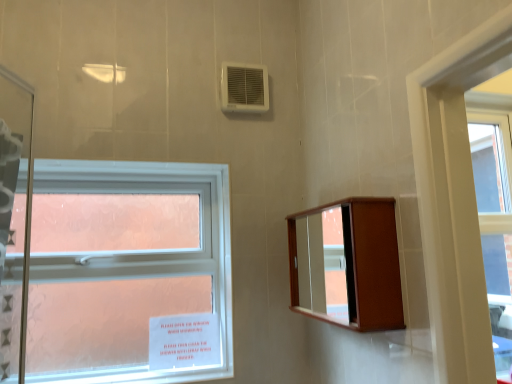
Locate an element on the screen. This screenshot has height=384, width=512. clear glass window at left is located at coordinates (145, 252).

The width and height of the screenshot is (512, 384). In order to click on white plastic air conditioning unit at upper center in this screenshot , I will do `click(244, 88)`.

Describe the element at coordinates (347, 264) in the screenshot. I see `wooden medicine cabinet at upper right` at that location.

This screenshot has width=512, height=384. In order to click on clear glass window at left in this screenshot , I will do `click(145, 252)`.

Based on the photo, is white plastic air conditioning unit at upper center surrounded by wooden medicine cabinet at upper right?

Definitely not — white plastic air conditioning unit at upper center is not inside wooden medicine cabinet at upper right.

Who is shorter, wooden medicine cabinet at upper right or white plastic air conditioning unit at upper center?

white plastic air conditioning unit at upper center is shorter.

From the image's perspective, which one is positioned lower, wooden medicine cabinet at upper right or white plastic air conditioning unit at upper center?

wooden medicine cabinet at upper right.

Is wooden medicine cabinet at upper right touching white plastic air conditioning unit at upper center?

No, wooden medicine cabinet at upper right is not touching white plastic air conditioning unit at upper center.

How different are the orientations of white plastic air conditioning unit at upper center and clear glass window at left in degrees?

0.163 degrees.

At what (x,y) coordinates should I click in order to perform the action: click on air conditioning located above the clear glass window at left (from a real-world perspective). Please return your answer as a coordinate pair (x, y). The image size is (512, 384). Looking at the image, I should click on (244, 88).

From the image's perspective, is white plastic air conditioning unit at upper center above or below clear glass window at left?

white plastic air conditioning unit at upper center is situated higher than clear glass window at left in the image.

How distant is white plastic air conditioning unit at upper center from clear glass window at left?

white plastic air conditioning unit at upper center is 22.80 inches away from clear glass window at left.

Can you confirm if clear glass window at left is smaller than white plastic air conditioning unit at upper center?

Incorrect, clear glass window at left is not smaller in size than white plastic air conditioning unit at upper center.

Between clear glass window at left and white plastic air conditioning unit at upper center, which one appears on the left side from the viewer's perspective?

clear glass window at left.

Does point (108, 372) come closer to viewer compared to point (246, 66)?

Yes, point (108, 372) is closer to viewer.

From a real-world perspective, between wooden medicine cabinet at upper right and clear glass window at left, who is vertically higher?

In real-world perspective, wooden medicine cabinet at upper right is above.

Relative to clear glass window at left, is wooden medicine cabinet at upper right in front or behind?

In the image, wooden medicine cabinet at upper right appears in front of clear glass window at left.

Does wooden medicine cabinet at upper right have a greater height compared to clear glass window at left?

No.

Considering the positions of point (380, 234) and point (94, 167), is point (380, 234) closer or farther from the camera than point (94, 167)?

Point (380, 234).

Is clear glass window at left smaller than wooden medicine cabinet at upper right?

No, clear glass window at left is not smaller than wooden medicine cabinet at upper right.

Who is taller, clear glass window at left or wooden medicine cabinet at upper right?

clear glass window at left.

Locate an element on the screen. This screenshot has height=384, width=512. window that appears below the wooden medicine cabinet at upper right (from the image's perspective) is located at coordinates (145, 252).

Is white plastic air conditioning unit at upper center taller or shorter than wooden medicine cabinet at upper right?

In the image, white plastic air conditioning unit at upper center appears to be shorter than wooden medicine cabinet at upper right.

Which is less distant, (254,101) or (366,259)?

The point (366,259) is more forward.

Is the depth of white plastic air conditioning unit at upper center less than that of wooden medicine cabinet at upper right?

No, white plastic air conditioning unit at upper center is further to the viewer.

Are white plastic air conditioning unit at upper center and wooden medicine cabinet at upper right located far from each other?

Actually, white plastic air conditioning unit at upper center and wooden medicine cabinet at upper right are a little close together.

Image resolution: width=512 pixels, height=384 pixels. Identify the location of medicine cabinet located below the white plastic air conditioning unit at upper center (from the image's perspective). (347, 264).

This screenshot has height=384, width=512. In order to click on window in front of the white plastic air conditioning unit at upper center in this screenshot , I will do `click(145, 252)`.

Based on their spatial positions, is white plastic air conditioning unit at upper center or wooden medicine cabinet at upper right further from clear glass window at left?

white plastic air conditioning unit at upper center lies further to clear glass window at left than the other object.

Looking at the image, which one is located closer to clear glass window at left, wooden medicine cabinet at upper right or white plastic air conditioning unit at upper center?

wooden medicine cabinet at upper right.

From the image, which object appears to be farther from wooden medicine cabinet at upper right, white plastic air conditioning unit at upper center or clear glass window at left?

white plastic air conditioning unit at upper center.

Based on the photo, when comparing their distances from white plastic air conditioning unit at upper center, does clear glass window at left or wooden medicine cabinet at upper right seem further?

Based on the image, wooden medicine cabinet at upper right appears to be further to white plastic air conditioning unit at upper center.

Looking at the image, which one is located further to wooden medicine cabinet at upper right, clear glass window at left or white plastic air conditioning unit at upper center?

The object further to wooden medicine cabinet at upper right is white plastic air conditioning unit at upper center.

From the image, which object appears to be nearer to white plastic air conditioning unit at upper center, wooden medicine cabinet at upper right or clear glass window at left?

Based on the image, clear glass window at left appears to be nearer to white plastic air conditioning unit at upper center.

Locate an element on the screen. The image size is (512, 384). medicine cabinet between white plastic air conditioning unit at upper center and clear glass window at left in the up-down direction is located at coordinates (347, 264).